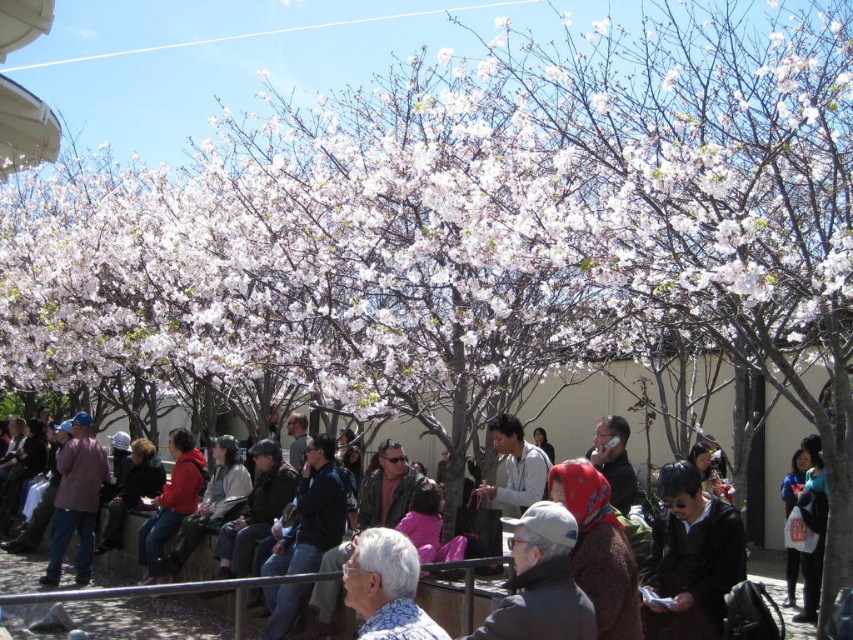
Question: Among these points, which one is nearest to the camera?

Choices:
 (A) (477, 611)
 (B) (74, 480)
 (C) (376, 556)
 (D) (611, 460)

Answer: (C)

Question: Estimate the real-world distances between objects in this image. Which object is closer to the white paper airplane at upper center?

Choices:
 (A) dark gray sweater at center
 (B) matte black jacket at center

Answer: (A)

Question: In this image, where is matte black jacket at center located relative to matte pink jacket at left?

Choices:
 (A) left
 (B) right

Answer: (B)

Question: Can you confirm if white paper airplane at upper center is positioned below matte black phone at center?

Choices:
 (A) yes
 (B) no

Answer: (B)

Question: Estimate the real-world distances between objects in this image. Which object is farther from the white paper airplane at upper center?

Choices:
 (A) matte black phone at center
 (B) dark gray sweater at center

Answer: (B)

Question: Can you confirm if gray fabric cap at center is positioned to the left of matte black jacket at center?

Choices:
 (A) yes
 (B) no

Answer: (B)